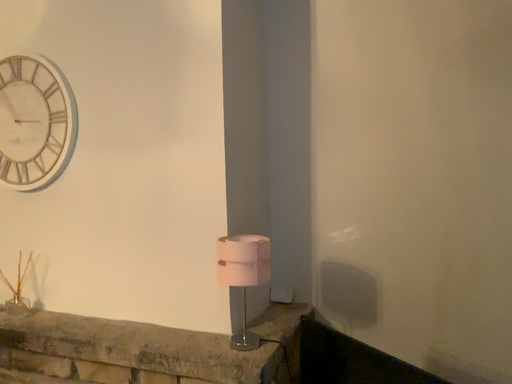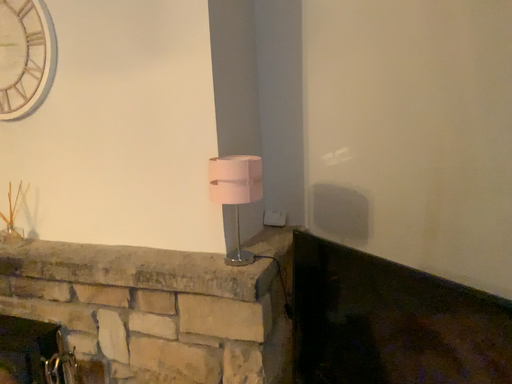
Question: How did the camera likely rotate when shooting the video?

Choices:
 (A) rotated downward
 (B) rotated upward

Answer: (A)